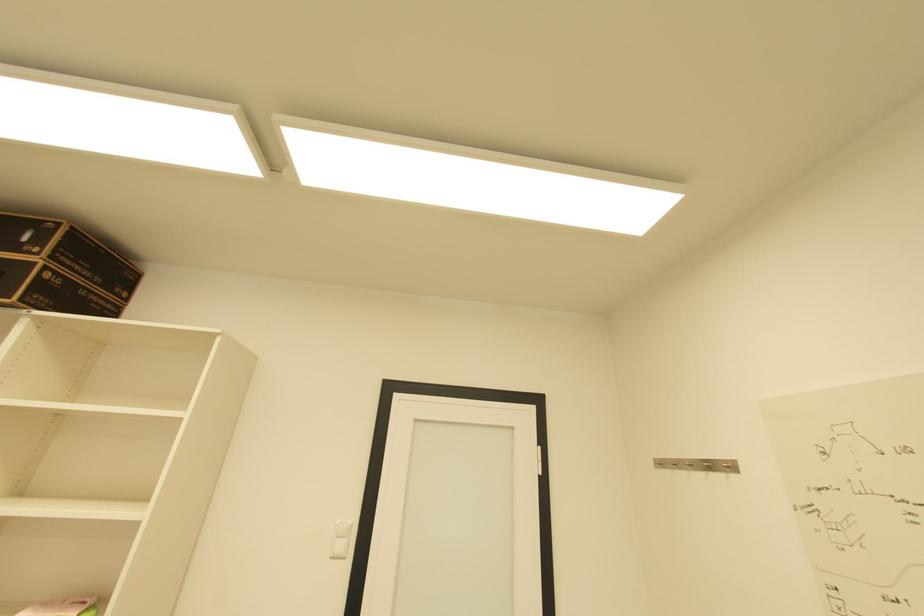
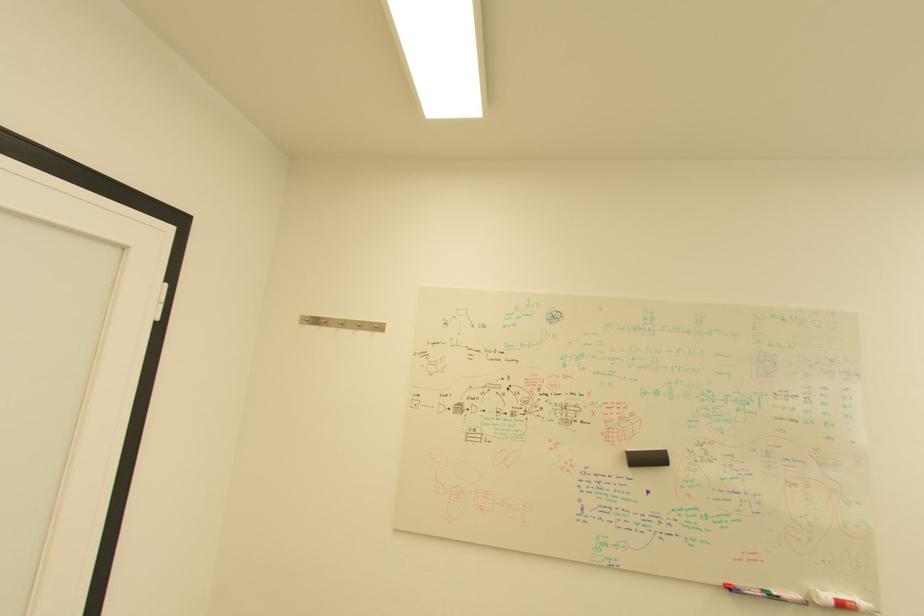
Question: The images are taken continuously from a first-person perspective. In which direction is your viewpoint rotating?

Choices:
 (A) Left
 (B) Right
 (C) Up
 (D) Down

Answer: (B)